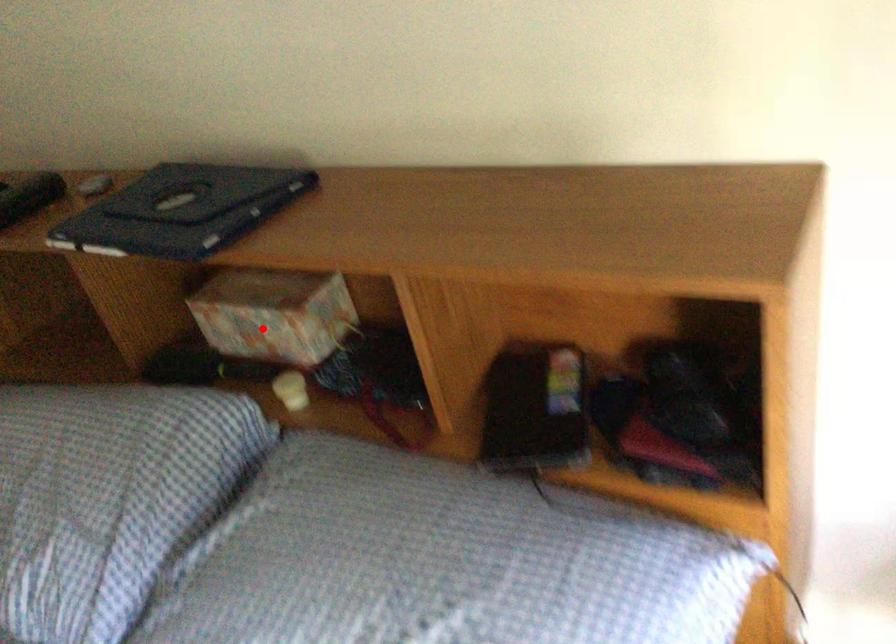
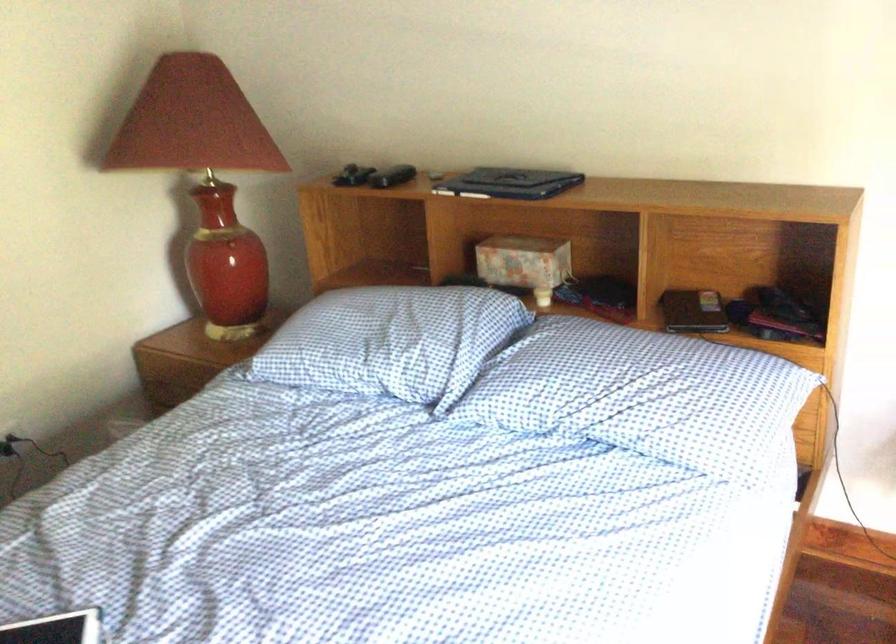
Question: A red point is marked in image1. In image2, is the corresponding 3D point closer to the camera or farther? Reply with the corresponding letter.

Choices:
 (A) The corresponding 3D point is closer.
 (B) The corresponding 3D point is farther.

Answer: (B)